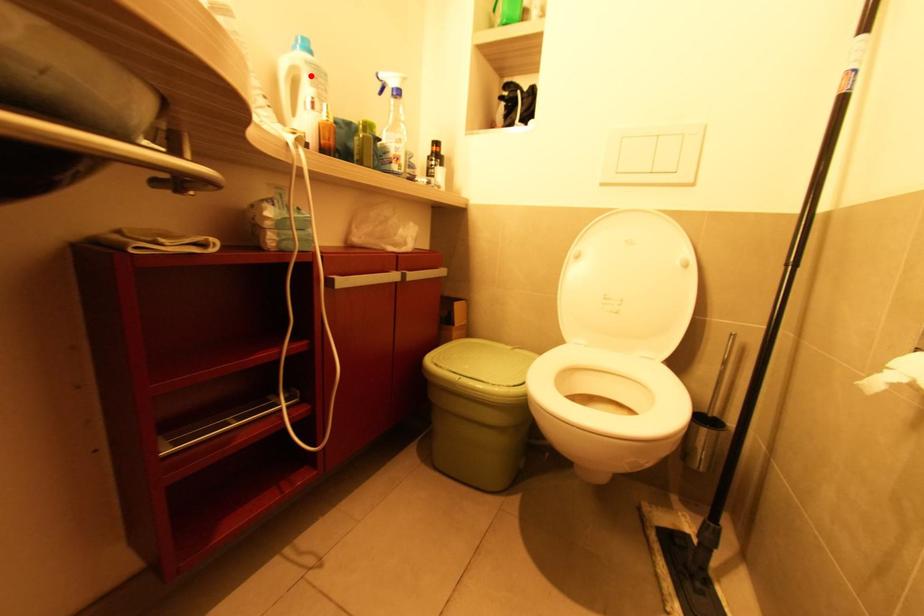
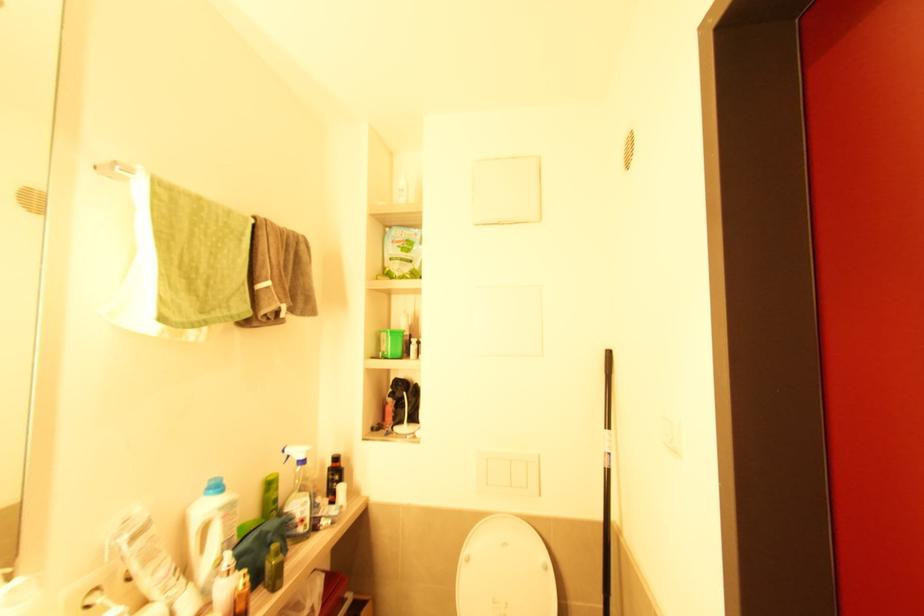
Where in the second image is the point corresponding to the highlighted location from the first image?

(224, 519)